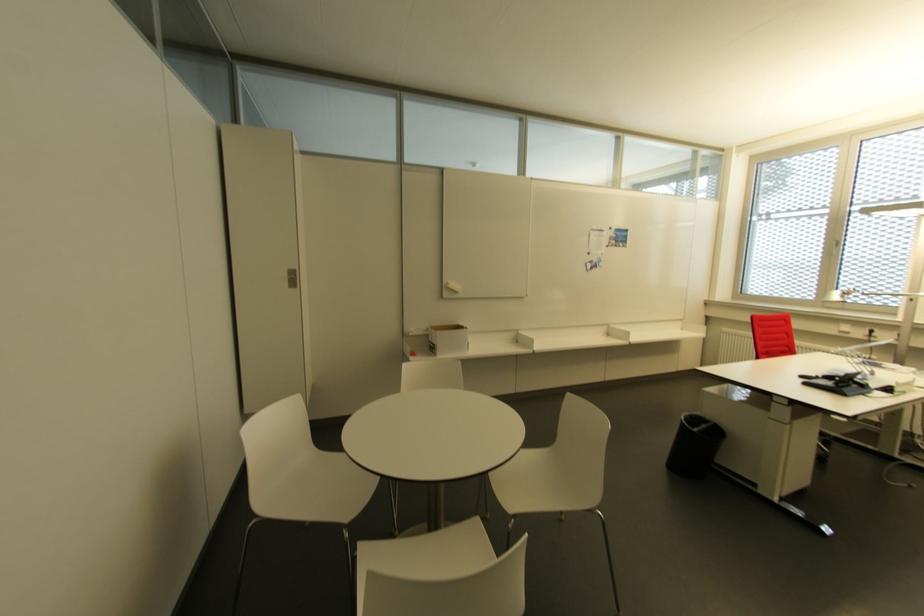
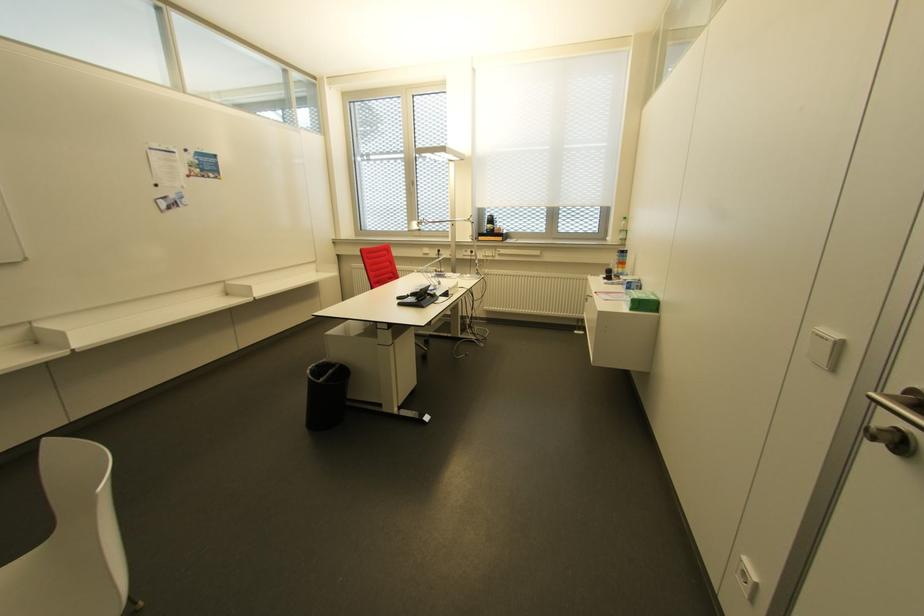
Find the pixel in the second image that matches [701,426] in the first image.

(329, 371)